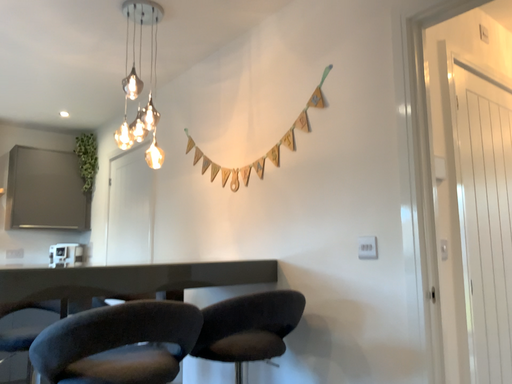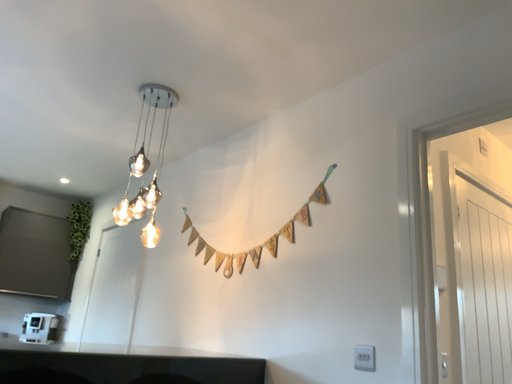
Question: How did the camera likely rotate when shooting the video?

Choices:
 (A) rotated downward
 (B) rotated upward

Answer: (B)